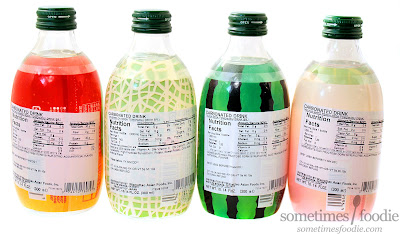
In order to click on bottle in this screenshot , I will do `click(56, 50)`, `click(148, 45)`, `click(345, 55)`, `click(240, 51)`.